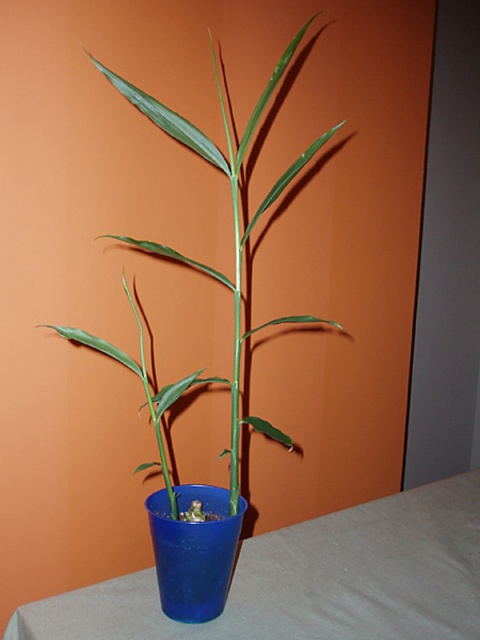
Question: Can you confirm if green glossy plant at center is positioned above blue plastic cup at center?

Choices:
 (A) yes
 (B) no

Answer: (A)

Question: Can you confirm if green glossy plant at center is positioned to the right of blue plastic cup at center?

Choices:
 (A) no
 (B) yes

Answer: (A)

Question: Does blue plastic table at center appear on the right side of green glossy plant at center?

Choices:
 (A) no
 (B) yes

Answer: (B)

Question: Which object is closer to the camera taking this photo?

Choices:
 (A) blue plastic table at center
 (B) green glossy plant at center

Answer: (B)

Question: Which is farther from the blue plastic cup at center?

Choices:
 (A) blue plastic table at center
 (B) green glossy plant at center

Answer: (B)

Question: Which of the following is the closest to the observer?

Choices:
 (A) blue plastic cup at center
 (B) green glossy plant at center
 (C) blue plastic table at center

Answer: (B)